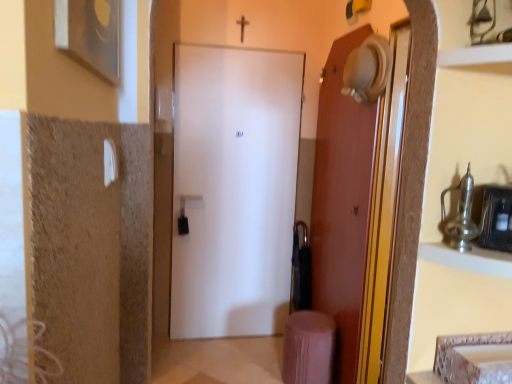
Question: Is metallic silver cabinet at upper right taller or shorter than pink fabric stool at lower right?

Choices:
 (A) short
 (B) tall

Answer: (A)

Question: Based on their sizes in the image, would you say metallic silver cabinet at upper right is bigger or smaller than pink fabric stool at lower right?

Choices:
 (A) big
 (B) small

Answer: (B)

Question: Based on their relative distances, which object is farther from the metallic silver medicine cabinet at right?

Choices:
 (A) white matte door at center, the 1th door in the left-to-right sequence
 (B) metallic silver cabinet at upper right
 (C) matte brown door at right, the second door viewed from the left
 (D) pink fabric stool at lower right
 (E) metallic silver shelf at upper right

Answer: (A)

Question: Which object is the farthest from the metallic silver cabinet at upper right?

Choices:
 (A) matte brown door at right, the first door when ordered from right to left
 (B) white matte door at center, which appears as the second door when viewed from the right
 (C) metallic silver shelf at upper right
 (D) metallic silver medicine cabinet at right
 (E) pink fabric stool at lower right

Answer: (B)